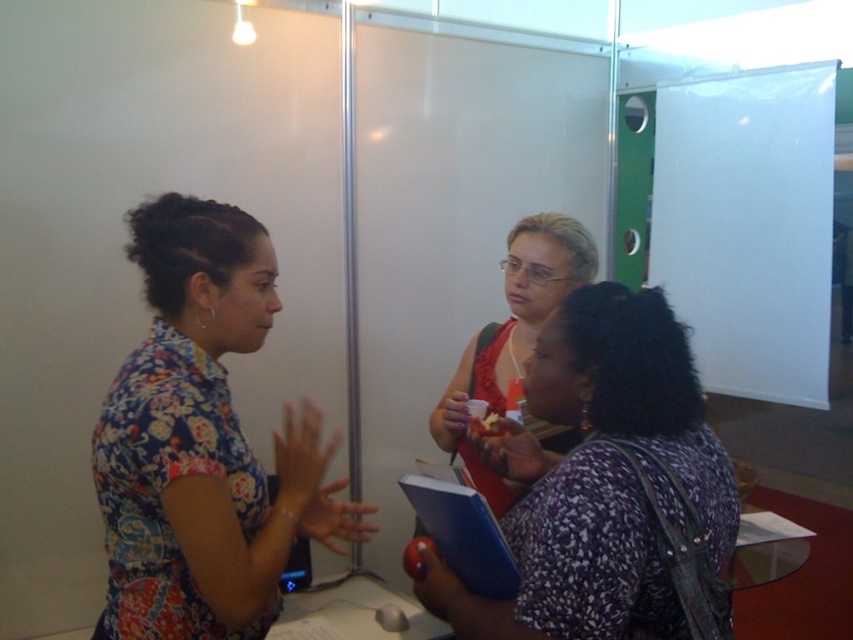
Question: Which point appears closest to the camera in this image?

Choices:
 (A) (602, 529)
 (B) (143, 356)

Answer: (A)

Question: Is the position of floral fabric shirt at left less distant than that of matte red dress at center?

Choices:
 (A) yes
 (B) no

Answer: (A)

Question: Where is floral fabric shirt at left located in relation to matte red dress at center in the image?

Choices:
 (A) left
 (B) right

Answer: (A)

Question: Does speckled fabric purse at lower right have a greater width compared to matte red dress at center?

Choices:
 (A) yes
 (B) no

Answer: (A)

Question: Which object is the closest to the speckled fabric purse at lower right?

Choices:
 (A) matte red dress at center
 (B) floral fabric shirt at left

Answer: (B)

Question: Which point is closer to the camera?

Choices:
 (A) matte red dress at center
 (B) floral fabric shirt at left

Answer: (B)